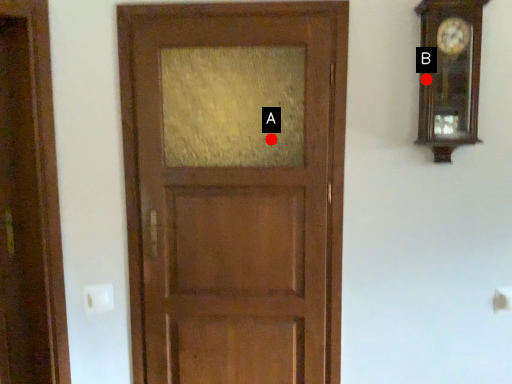
Question: Two points are circled on the image, labeled by A and B beside each circle. Among these points, which one is farthest from the camera?

Choices:
 (A) A is further
 (B) B is further

Answer: (A)